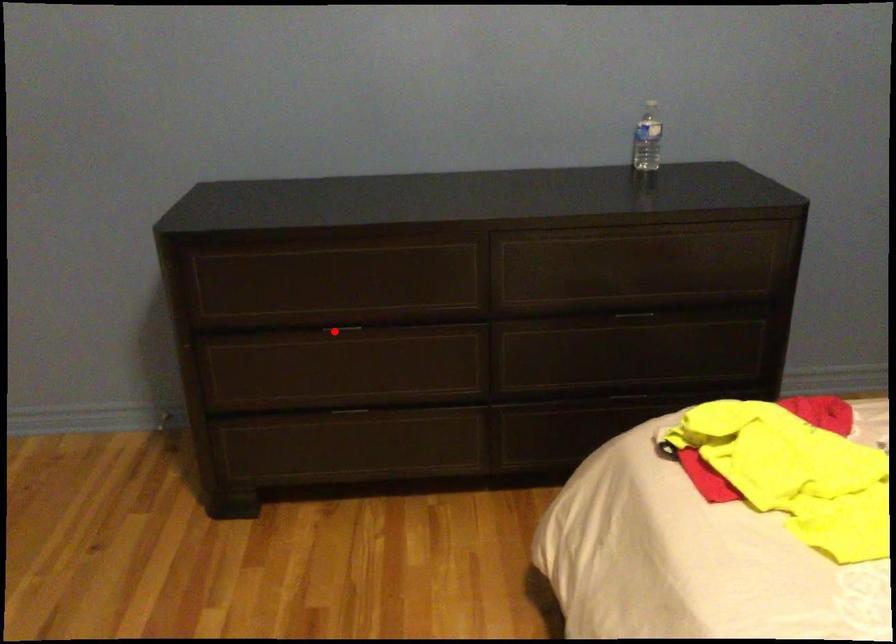
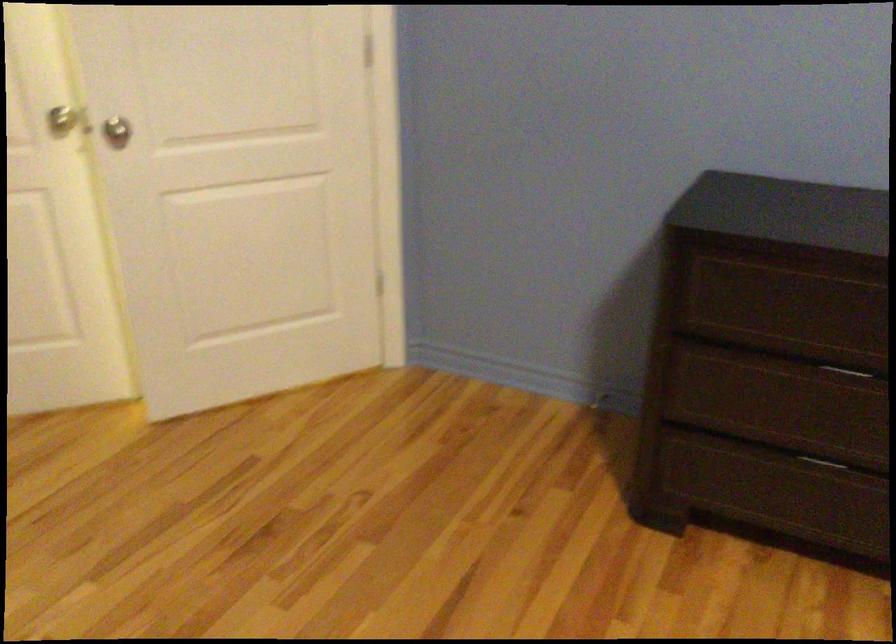
Where in the second image is the point corresponding to the highlighted location from the first image?

(850, 371)